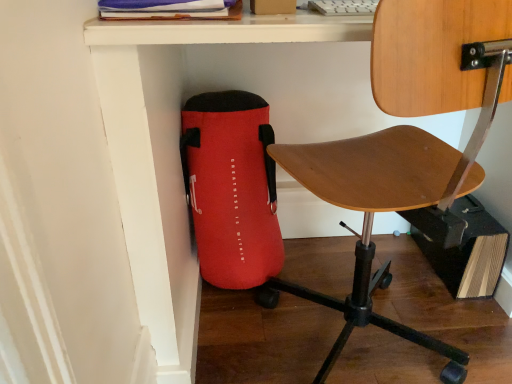
Question: Considering the positions of red fabric bag at lower left and wooden seat at center in the image, is red fabric bag at lower left bigger or smaller than wooden seat at center?

Choices:
 (A) big
 (B) small

Answer: (B)

Question: From a real-world perspective, is red fabric bag at lower left physically located above or below wooden seat at center?

Choices:
 (A) below
 (B) above

Answer: (A)

Question: Is red fabric bag at lower left wider or thinner than wooden seat at center?

Choices:
 (A) thin
 (B) wide

Answer: (A)

Question: Which is correct: wooden seat at center is inside red fabric bag at lower left, or outside of it?

Choices:
 (A) inside
 (B) outside

Answer: (B)

Question: Is wooden seat at center in front of or behind red fabric bag at lower left in the image?

Choices:
 (A) behind
 (B) front

Answer: (B)

Question: Is wooden seat at center bigger or smaller than red fabric bag at lower left?

Choices:
 (A) small
 (B) big

Answer: (B)

Question: From the image's perspective, is wooden seat at center above or below red fabric bag at lower left?

Choices:
 (A) above
 (B) below

Answer: (A)